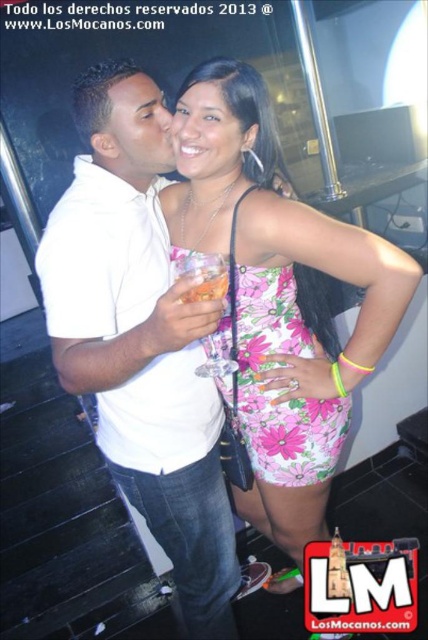
Question: Which of the following is the farthest from the observer?

Choices:
 (A) (315, 416)
 (B) (205, 264)
 (C) (152, 176)

Answer: (A)

Question: Estimate the real-world distances between objects in this image. Which object is farther from the translucent glass drink at center?

Choices:
 (A) pink floral dress at center
 (B) white matte shirt at center

Answer: (A)

Question: Among these objects, which one is nearest to the camera?

Choices:
 (A) pink floral dress at center
 (B) white matte shirt at center

Answer: (B)

Question: Is white matte shirt at center smaller than translucent glass drink at center?

Choices:
 (A) no
 (B) yes

Answer: (A)

Question: Is white matte shirt at center above translucent glass drink at center?

Choices:
 (A) no
 (B) yes

Answer: (A)

Question: Is white matte shirt at center positioned in front of pink floral dress at center?

Choices:
 (A) yes
 (B) no

Answer: (A)